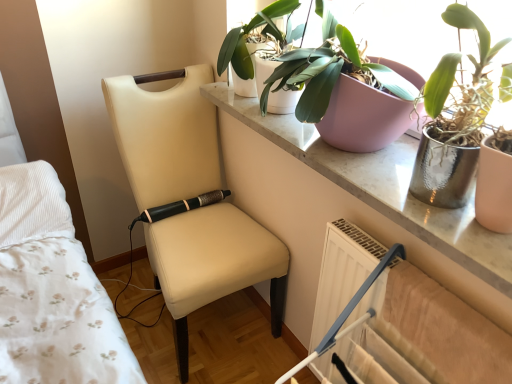
Question: Does metallic silver pot at upper right, acting as the 3th houseplant starting from the left, have a lesser width compared to beige leather chair at center?

Choices:
 (A) yes
 (B) no

Answer: (A)

Question: Does metallic silver pot at upper right, acting as the 3th houseplant starting from the left, have a larger size compared to beige leather chair at center?

Choices:
 (A) no
 (B) yes

Answer: (A)

Question: Is metallic silver pot at upper right, which is the first houseplant from right to left, aimed at beige leather chair at center?

Choices:
 (A) yes
 (B) no

Answer: (B)

Question: Considering the relative positions of metallic silver pot at upper right, acting as the 3th houseplant starting from the left, and beige leather chair at center in the image provided, is metallic silver pot at upper right, acting as the 3th houseplant starting from the left, to the left of beige leather chair at center from the viewer's perspective?

Choices:
 (A) yes
 (B) no

Answer: (B)

Question: From a real-world perspective, is metallic silver pot at upper right, which is the first houseplant from right to left, beneath beige leather chair at center?

Choices:
 (A) yes
 (B) no

Answer: (B)

Question: Can you confirm if metallic silver pot at upper right, acting as the 3th houseplant starting from the left, is wider than beige leather chair at center?

Choices:
 (A) no
 (B) yes

Answer: (A)

Question: Does metallic silver pot at upper right, acting as the 3th houseplant starting from the left, have a greater width compared to metallic silver pot at upper right, marked as the 2th houseplant in a right-to-left arrangement?

Choices:
 (A) no
 (B) yes

Answer: (B)

Question: Are metallic silver pot at upper right, acting as the 3th houseplant starting from the left, and metallic silver pot at upper right, marked as the 2th houseplant in a right-to-left arrangement, located far from each other?

Choices:
 (A) yes
 (B) no

Answer: (B)

Question: Does metallic silver pot at upper right, acting as the 3th houseplant starting from the left, have a larger size compared to metallic silver pot at upper right, placed as the second houseplant when sorted from left to right?

Choices:
 (A) no
 (B) yes

Answer: (A)

Question: Is metallic silver pot at upper right, which is the first houseplant from right to left, further to camera compared to metallic silver pot at upper right, marked as the 2th houseplant in a right-to-left arrangement?

Choices:
 (A) yes
 (B) no

Answer: (B)

Question: Considering the relative sizes of metallic silver pot at upper right, which is the first houseplant from right to left, and metallic silver pot at upper right, placed as the second houseplant when sorted from left to right, in the image provided, is metallic silver pot at upper right, which is the first houseplant from right to left, shorter than metallic silver pot at upper right, placed as the second houseplant when sorted from left to right,?

Choices:
 (A) no
 (B) yes

Answer: (A)

Question: From a real-world perspective, is metallic silver pot at upper right, acting as the 3th houseplant starting from the left, physically above metallic silver pot at upper right, placed as the second houseplant when sorted from left to right?

Choices:
 (A) yes
 (B) no

Answer: (A)

Question: Could green matte plant at upper center, which is the 3th houseplant in right-to-left order, be considered to be inside metallic silver pot at upper right, marked as the 2th houseplant in a right-to-left arrangement?

Choices:
 (A) yes
 (B) no

Answer: (B)